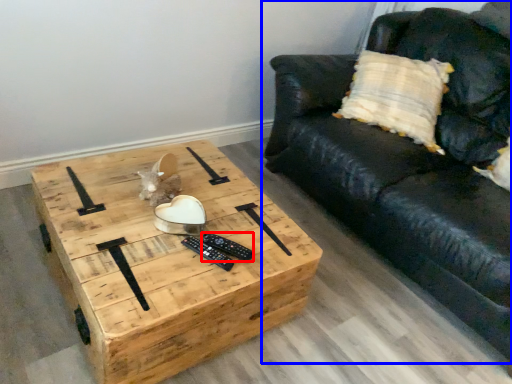
Question: Which object appears farthest to the camera in this image, remote (highlighted by a red box) or studio couch (highlighted by a blue box)?

Choices:
 (A) remote
 (B) studio couch

Answer: (A)